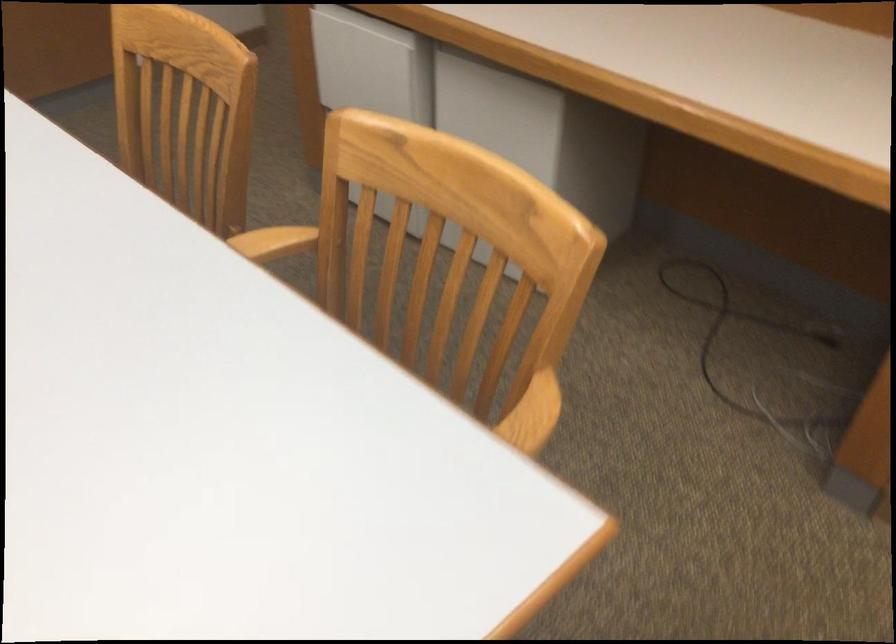
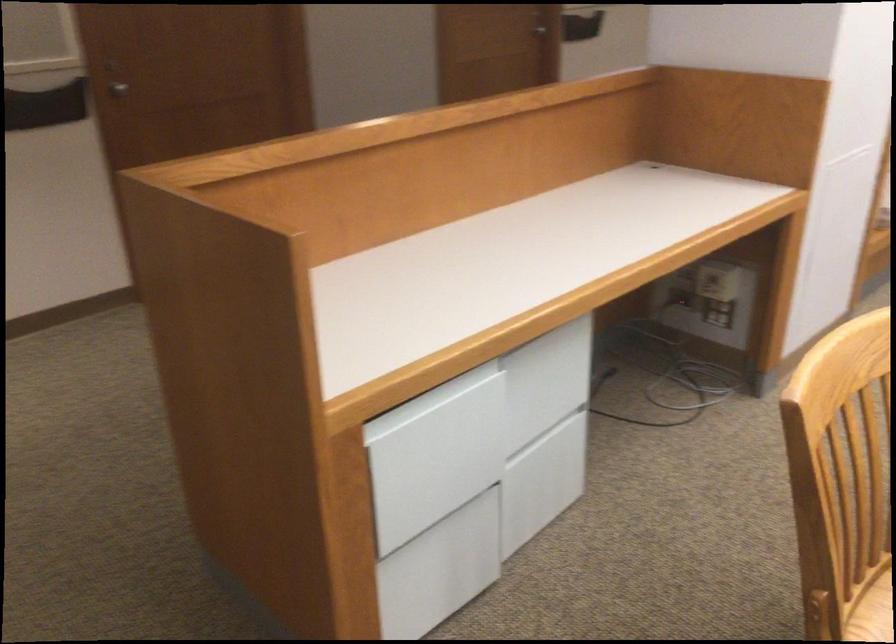
The point at (x=352, y=95) is marked in the first image. Where is the corresponding point in the second image?

(436, 500)